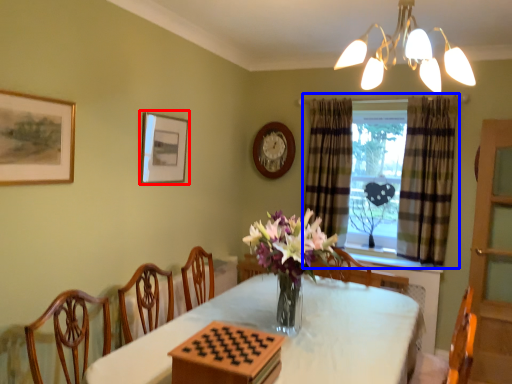
Question: Which point is closer to the camera, picture frame (highlighted by a red box) or window (highlighted by a blue box)?

Choices:
 (A) picture frame
 (B) window

Answer: (A)